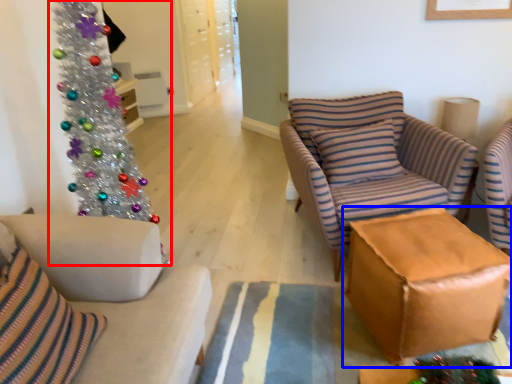
Question: Which object appears closest to the camera in this image, christmas tree (highlighted by a red box) or table (highlighted by a blue box)?

Choices:
 (A) christmas tree
 (B) table

Answer: (A)